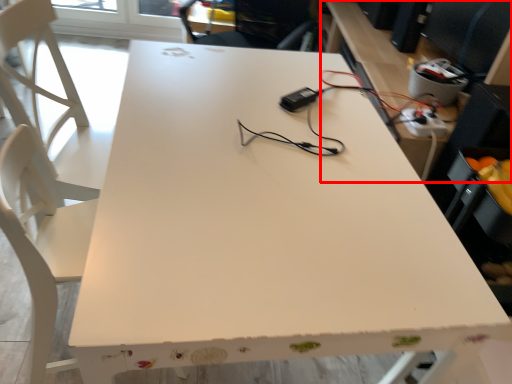
Question: From the image's perspective, where is computer desk (annotated by the red box) located relative to extension cord?

Choices:
 (A) below
 (B) above

Answer: (B)